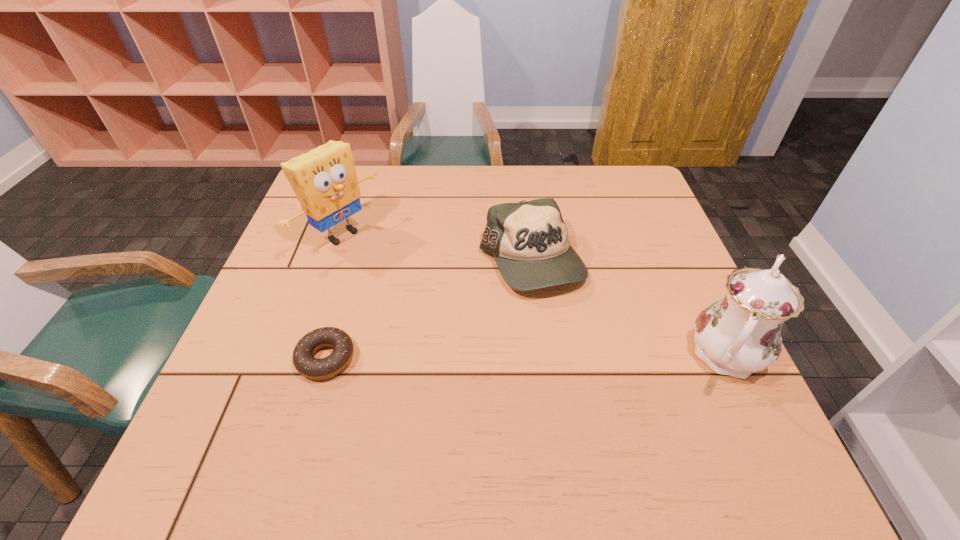
What are the coordinates of `object present at the near left corner` in the screenshot? It's located at (306, 364).

I want to click on object located in the near right corner section of the desktop, so click(x=740, y=334).

In the image, there is a desktop. Where is `vacant space at the far edge`? vacant space at the far edge is located at coordinates (481, 189).

The width and height of the screenshot is (960, 540). What are the coordinates of `free space at the near edge of the desktop` in the screenshot? It's located at (637, 408).

Identify the location of free space at the left edge. This screenshot has height=540, width=960. (291, 284).

In the image, there is a desktop. Identify the location of free space at the right edge. (638, 308).

Identify the location of free point at the far left corner. (367, 177).

Locate an element on the screen. free region at the far right corner is located at coordinates tap(617, 187).

Locate an element on the screen. This screenshot has width=960, height=540. vacant space that is in between the doughnut and the sponge is located at coordinates (333, 296).

Find the location of `vacant point located between the second object from right to left and the chinaware`. vacant point located between the second object from right to left and the chinaware is located at coordinates (629, 308).